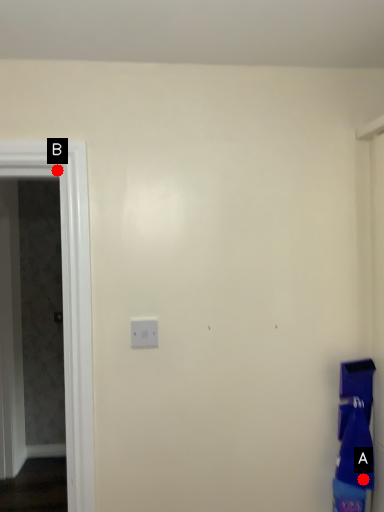
Question: Two points are circled on the image, labeled by A and B beside each circle. Among these points, which one is nearest to the camera?

Choices:
 (A) A is closer
 (B) B is closer

Answer: (A)